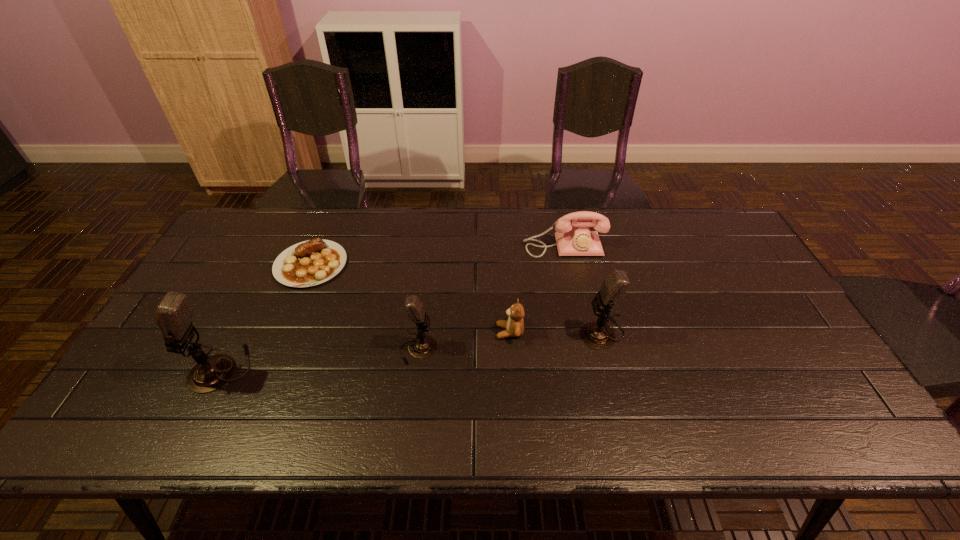
Given the evenly spaced microphones in the image, where should an extra microphone be added on the right to preserve the spacing? Please point to a vacant space. Please provide its 2D coordinates. Your answer should be formatted as a tuple, i.e. [(x, y)], where the tuple contains the x and y coordinates of a point satisfying the conditions above.

[(773, 315)]